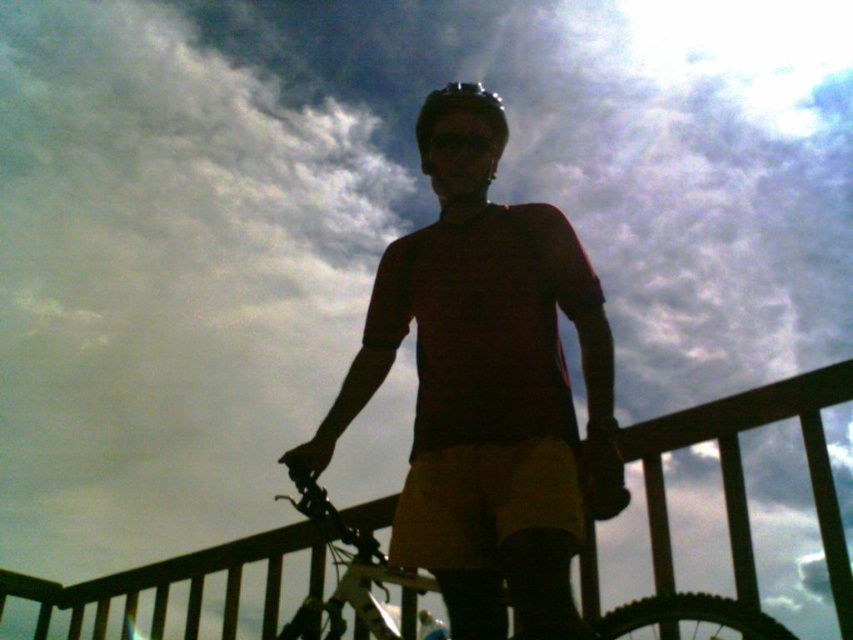
Question: Which point is farther to the camera?

Choices:
 (A) metallic silver bicycle at center
 (B) matte red shirt at center

Answer: (A)

Question: Based on their relative distances, which object is farther from the matte black helmet at center?

Choices:
 (A) black wood rail at center
 (B) matte red shirt at center
 (C) metallic silver bicycle at center

Answer: (A)

Question: Observing the image, what is the correct spatial positioning of black wood rail at center in reference to metallic silver bicycle at center?

Choices:
 (A) left
 (B) right

Answer: (A)

Question: Is black wood rail at center smaller than matte black helmet at center?

Choices:
 (A) yes
 (B) no

Answer: (B)

Question: Does black wood rail at center lie in front of matte black helmet at center?

Choices:
 (A) no
 (B) yes

Answer: (A)

Question: Which point is closer to the camera?

Choices:
 (A) metallic silver bicycle at center
 (B) black wood rail at center
 (C) matte red shirt at center

Answer: (C)